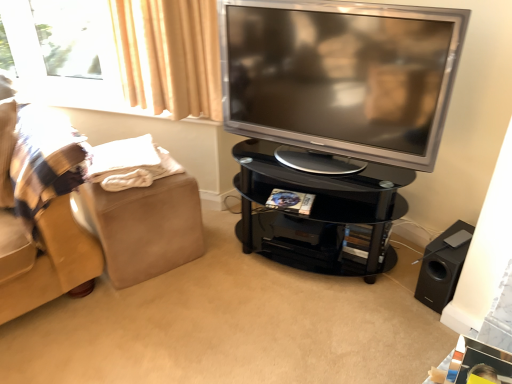
Question: Is black glass tv stand at center surrounded by beige fabric footrest at left?

Choices:
 (A) yes
 (B) no

Answer: (B)

Question: From a real-world perspective, is beige fabric footrest at left positioned under black glass tv stand at center based on gravity?

Choices:
 (A) no
 (B) yes

Answer: (B)

Question: Is beige fabric footrest at left further to camera compared to black glass tv stand at center?

Choices:
 (A) no
 (B) yes

Answer: (B)

Question: Considering the relative positions of beige fabric footrest at left and black glass tv stand at center in the image provided, is beige fabric footrest at left to the right of black glass tv stand at center from the viewer's perspective?

Choices:
 (A) no
 (B) yes

Answer: (A)

Question: Is beige fabric footrest at left facing towards black glass tv stand at center?

Choices:
 (A) no
 (B) yes

Answer: (A)

Question: Does beige fabric footrest at left have a larger size compared to black glass tv stand at center?

Choices:
 (A) no
 (B) yes

Answer: (A)

Question: Is black matte speaker at lower right in front of beige fabric footrest at left?

Choices:
 (A) no
 (B) yes

Answer: (B)

Question: Does black matte speaker at lower right contain beige fabric footrest at left?

Choices:
 (A) yes
 (B) no

Answer: (B)

Question: From a real-world perspective, is black matte speaker at lower right under beige fabric footrest at left?

Choices:
 (A) yes
 (B) no

Answer: (A)

Question: Does black matte speaker at lower right turn towards beige fabric footrest at left?

Choices:
 (A) yes
 (B) no

Answer: (B)

Question: Considering the relative sizes of black matte speaker at lower right and beige fabric footrest at left in the image provided, is black matte speaker at lower right wider than beige fabric footrest at left?

Choices:
 (A) yes
 (B) no

Answer: (B)

Question: Considering the relative sizes of black matte speaker at lower right and beige fabric footrest at left in the image provided, is black matte speaker at lower right thinner than beige fabric footrest at left?

Choices:
 (A) yes
 (B) no

Answer: (A)

Question: Is black glossy tv stand at center smaller than black matte speaker at lower right?

Choices:
 (A) yes
 (B) no

Answer: (B)